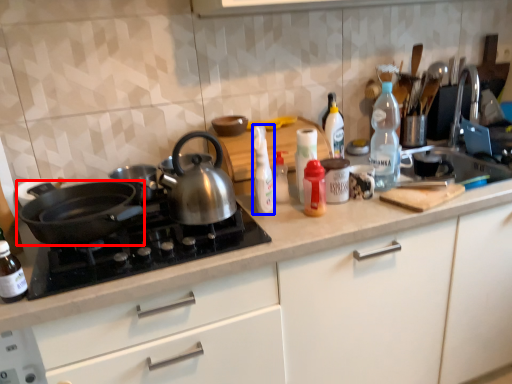
Question: Which of the following is the farthest to the observer, kitchen appliance (highlighted by a red box) or bottle (highlighted by a blue box)?

Choices:
 (A) kitchen appliance
 (B) bottle

Answer: (B)